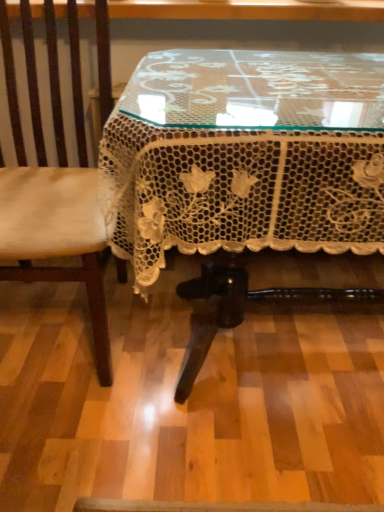
Question: From a real-world perspective, is light brown leather chair at left above or below white lace tablecloth at center?

Choices:
 (A) below
 (B) above

Answer: (B)

Question: Considering the positions of point (31, 106) and point (339, 200), is point (31, 106) closer or farther from the camera than point (339, 200)?

Choices:
 (A) closer
 (B) farther

Answer: (B)

Question: Considering their positions, is light brown leather chair at left located in front of or behind white lace tablecloth at center?

Choices:
 (A) behind
 (B) front

Answer: (A)

Question: From a real-world perspective, is white lace tablecloth at center above or below light brown leather chair at left?

Choices:
 (A) below
 (B) above

Answer: (A)

Question: Considering the relative positions of white lace tablecloth at center and light brown leather chair at left in the image provided, is white lace tablecloth at center to the left or to the right of light brown leather chair at left?

Choices:
 (A) right
 (B) left

Answer: (A)

Question: Is point pos(152,69) closer or farther from the camera than point pos(39,210)?

Choices:
 (A) closer
 (B) farther

Answer: (A)

Question: In terms of width, does white lace tablecloth at center look wider or thinner when compared to light brown leather chair at left?

Choices:
 (A) thin
 (B) wide

Answer: (B)